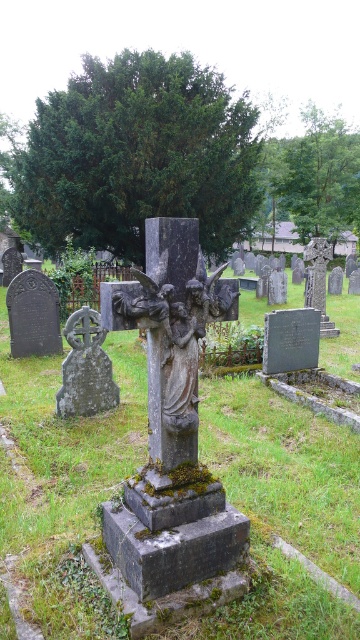
You are standing at the entrance of the cemetery and see the gray stone statue at center marked by point [171,365]. If you walk straight towards the statue, will you encounter any obstacles between you and the statue?

The gray stone statue at center is represented by point [171,365], so there are no obstacles between you and the statue when walking straight towards it.

You are standing at the entrance of the cemetery and see the gray stone statue at center and the gray stone cross at lower left. Which one is closer to you?

The gray stone statue at center is closer to you because it is in front of the gray stone cross at lower left.

You are a groundskeeper planning to place a new flowerpot between the gray stone statue at center and the gray stone cross at lower left. Based on their widths, which object should you consider for the placement to ensure the flowerpot fits comfortably?

The gray stone statue at center might be wider than the gray stone cross at lower left, so placing the flowerpot between them would require ensuring there is enough space between the two objects. However, since the statue is possibly wider, it might be better to position the flowerpot closer to the narrower gray stone cross at lower left to accommodate the statue.